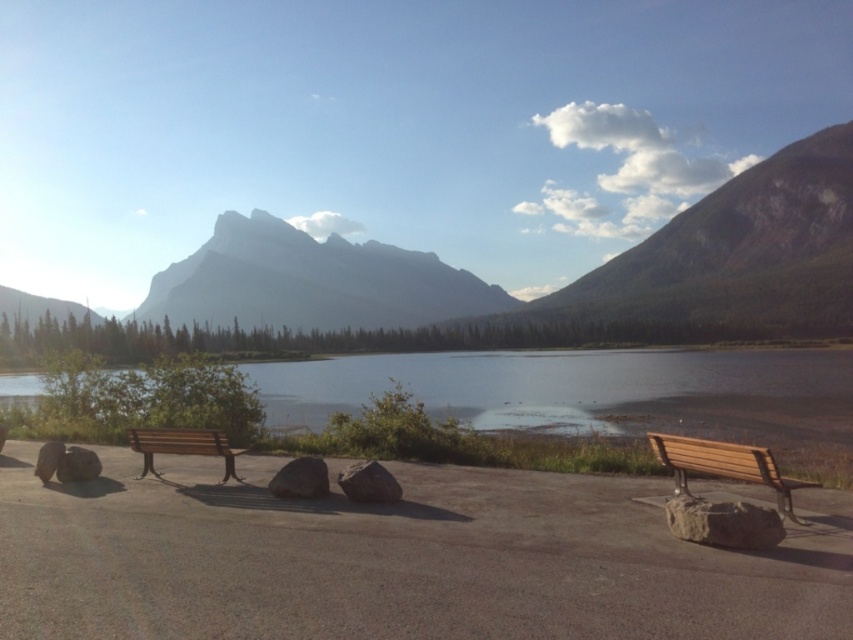
In the scene shown: You are a hiker standing on the paved area near the smooth brown water at center and the gray rough rock at center. You want to take a photo that includes both objects in the frame. Which object should you position closer to the camera to ensure both are fully visible?

You should position the gray rough rock at center closer to the camera since the smooth brown water at center is much taller than it, so placing the shorter object closer will help balance their sizes in the photo.

You are planning to place a small picnic basket on the wooden bench at left and the gray rough rock at center. Which surface will allow the basket to fit better based on their sizes?

The wooden bench at left has a larger width than the gray rough rock at center, so the picnic basket will fit better on the wooden bench at left.